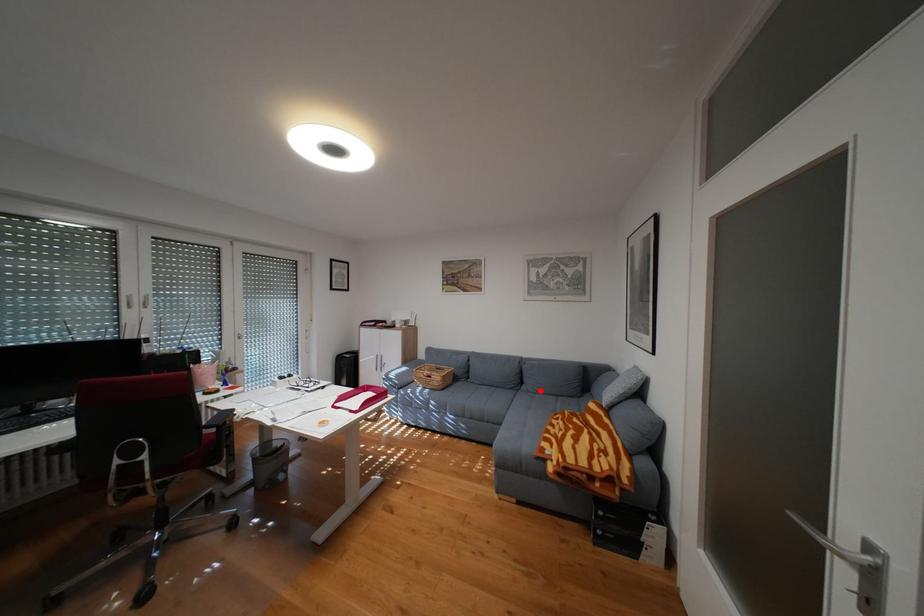
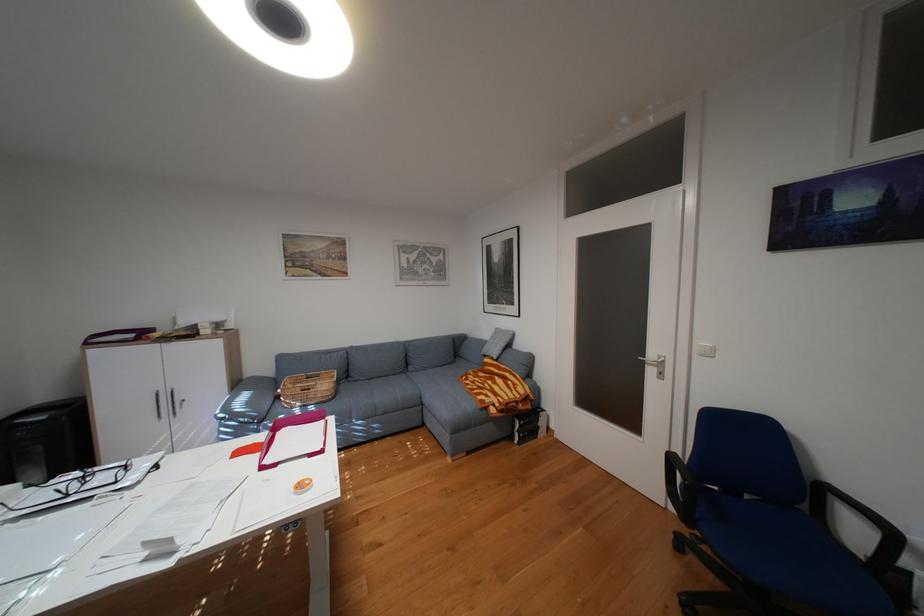
Question: I am providing you with two images of the same scene from different viewpoints. Image1 has a red point marked. In image2, the corresponding 3D location appears at what relative position? Reply with the corresponding letter.

Choices:
 (A) Closer
 (B) Farther

Answer: (A)